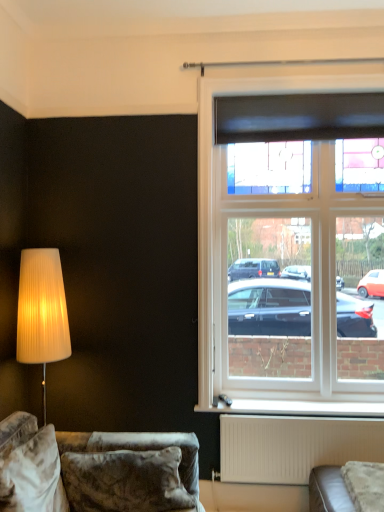
Identify the location of free area below black matte curtain at upper right (from a real-world perspective). (294, 401).